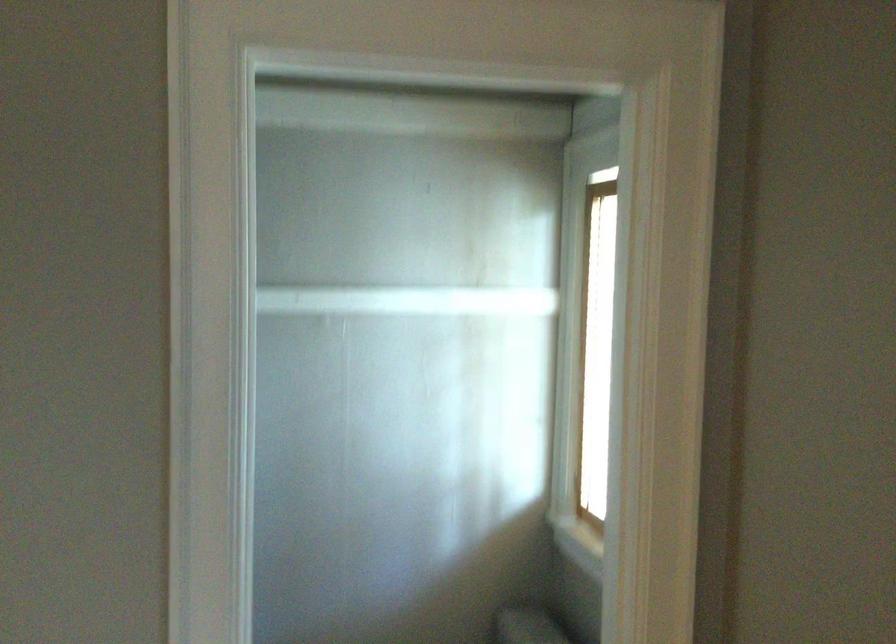
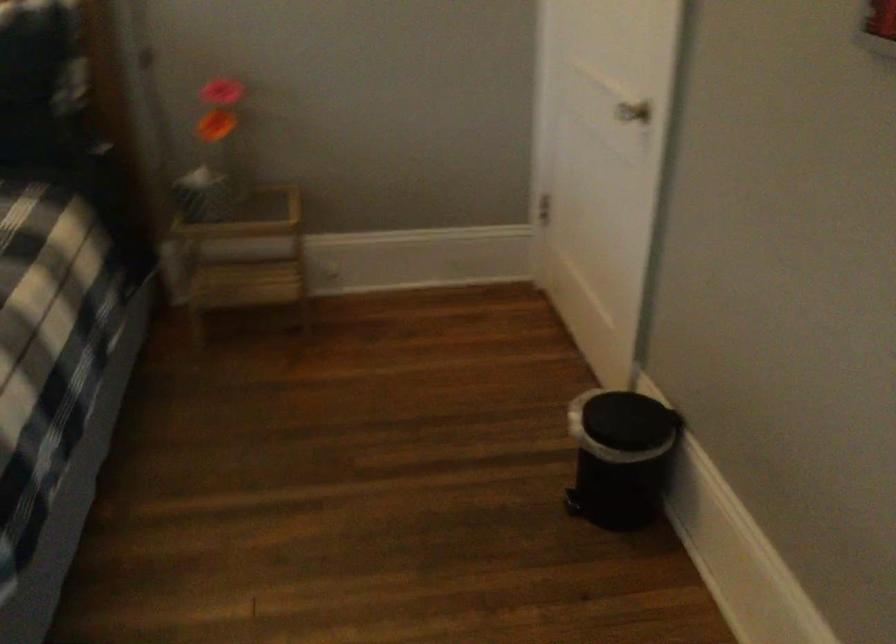
First-person continuous shooting, in which direction is the camera rotating?

The camera's rotation is toward left-down.